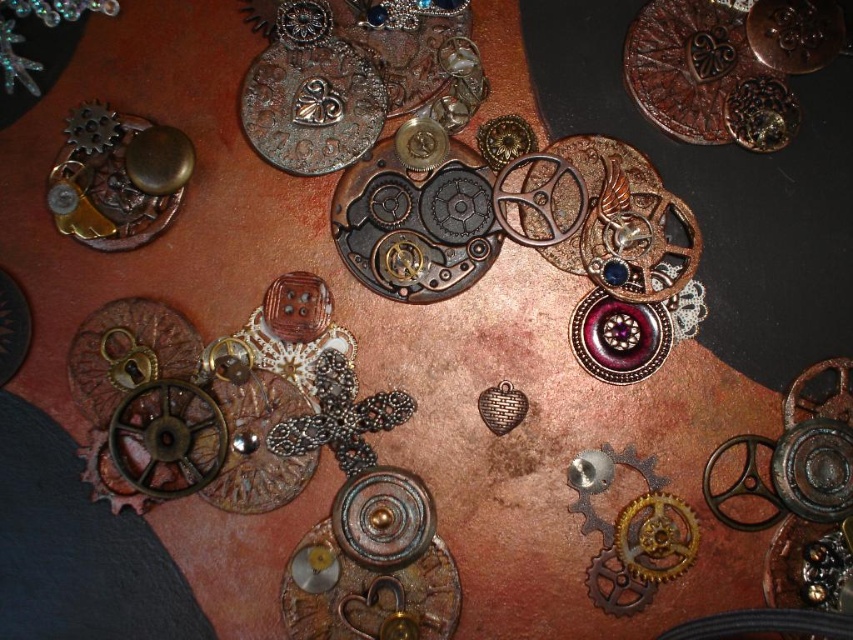
You are organizing a display of steampunk items and need to place a new item between the copper textured gear at upper right and the matte gold gear at upper left. Which gear should you place the new item closer to if you want it to be closer to the left side of the display?

You should place the new item closer to the matte gold gear at upper left because the copper textured gear at upper right is positioned to the right of the matte gold gear at upper left, so placing it near the matte gold gear would bring it closer to the left side of the display.

You are a collector standing 1 meter away from the copper textured gear at upper right. Can you reach it without moving your position?

The copper textured gear at upper right is 1.25 meters away from you, so you cannot reach it without moving closer.

You are an interior designer planning to place a small decorative item on a shelf. You have the copper textured gear at upper right and the antique bronze heart at center. Which of these two items would require more space on the shelf?

The copper textured gear at upper right is larger in size than the antique bronze heart at center, so it would require more space on the shelf.